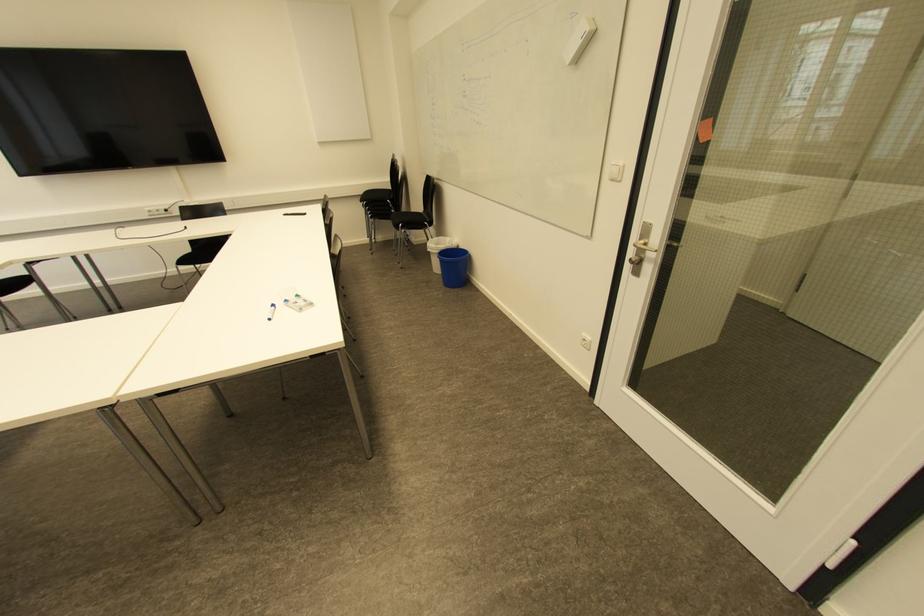
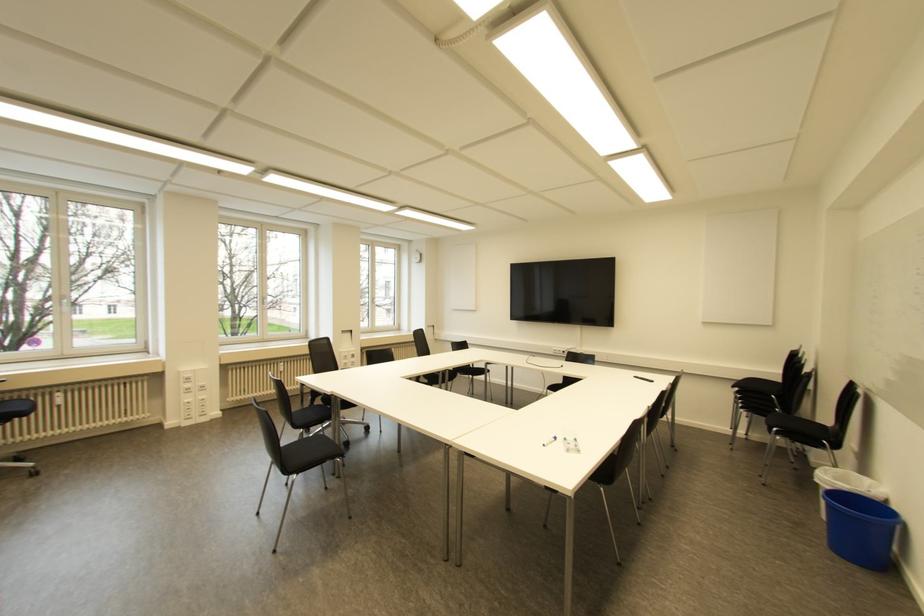
The point at (273, 306) is marked in the first image. Where is the corresponding point in the second image?

(554, 438)